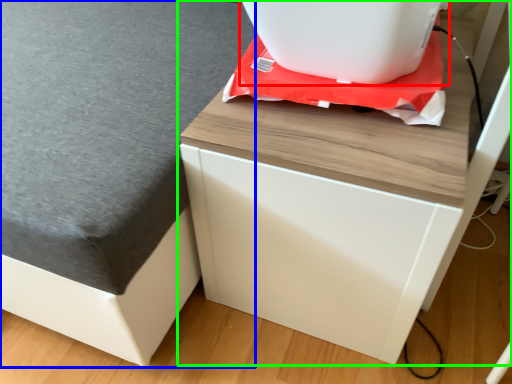
Question: Which is farther away from appliance (highlighted by a red box)? table top (highlighted by a blue box) or furniture (highlighted by a green box)?

Choices:
 (A) table top
 (B) furniture

Answer: (A)